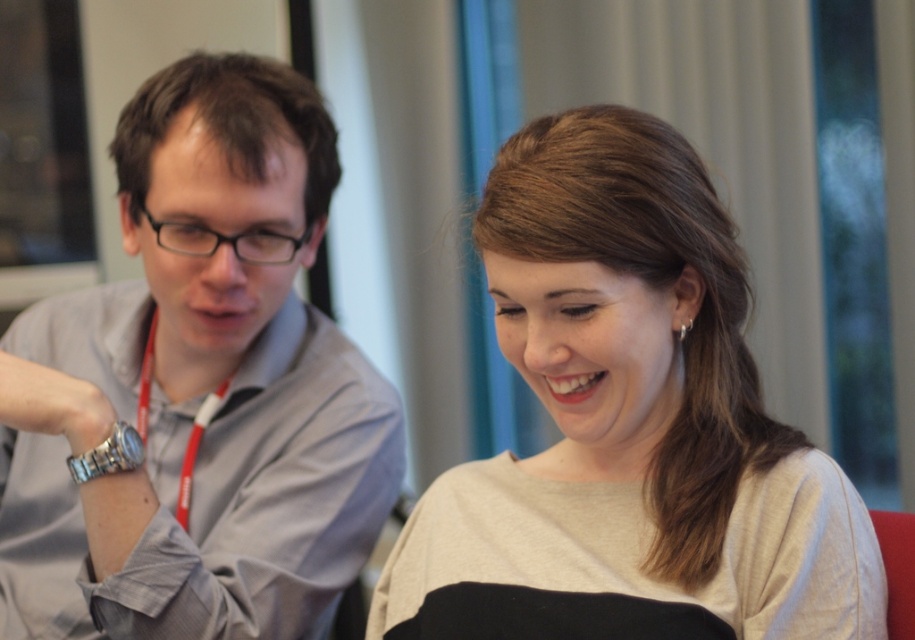
Question: Among these points, which one is nearest to the camera?

Choices:
 (A) (46, 496)
 (B) (531, 579)

Answer: (B)

Question: Observing the image, what is the correct spatial positioning of gray fabric shirt at left in reference to light beige sweater at center?

Choices:
 (A) below
 (B) above

Answer: (B)

Question: Does gray fabric shirt at left appear under light beige sweater at center?

Choices:
 (A) yes
 (B) no

Answer: (B)

Question: Does gray fabric shirt at left appear on the right side of light beige sweater at center?

Choices:
 (A) no
 (B) yes

Answer: (A)

Question: Which point is closer to the camera taking this photo?

Choices:
 (A) (119, 138)
 (B) (474, 516)

Answer: (B)